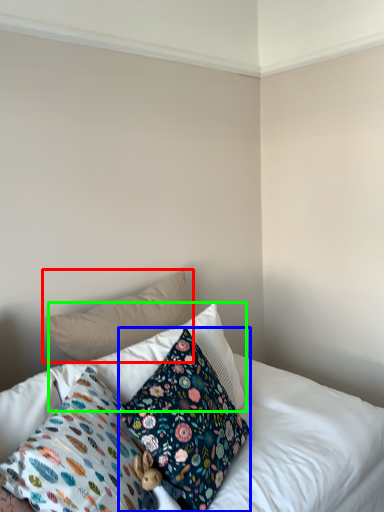
Question: Considering the real-world distances, which object is farthest from pillow (highlighted by a red box)? pillow (highlighted by a blue box) or pillow (highlighted by a green box)?

Choices:
 (A) pillow
 (B) pillow

Answer: (A)